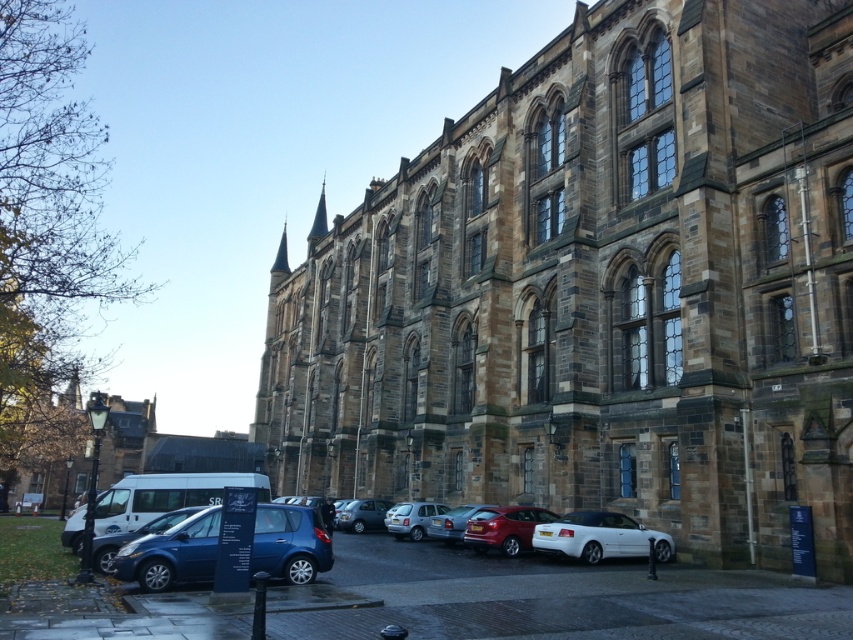
Question: Among these points, which one is nearest to the camera?

Choices:
 (A) (520, 525)
 (B) (184, 604)
 (C) (97, 552)
 (D) (283, 516)

Answer: (B)

Question: Is brown stone church at center positioned in front of metallic silver car at lower center?

Choices:
 (A) yes
 (B) no

Answer: (A)

Question: Which of the following is the farthest from the observer?

Choices:
 (A) matte red car at center
 (B) white glossy sedan at lower center
 (C) metallic blue hatchback at lower left
 (D) metallic blue hatchback at center

Answer: (A)

Question: Which object is closer to the camera taking this photo?

Choices:
 (A) brown stone church at center
 (B) white glossy sedan at lower center
 (C) metallic silver car at lower center
 (D) metallic silver cars at lower center

Answer: (D)

Question: Does metallic silver cars at lower center have a lesser width compared to metallic blue hatchback at center?

Choices:
 (A) no
 (B) yes

Answer: (A)

Question: Is brown stone church at center thinner than metallic blue hatchback at lower left?

Choices:
 (A) no
 (B) yes

Answer: (A)